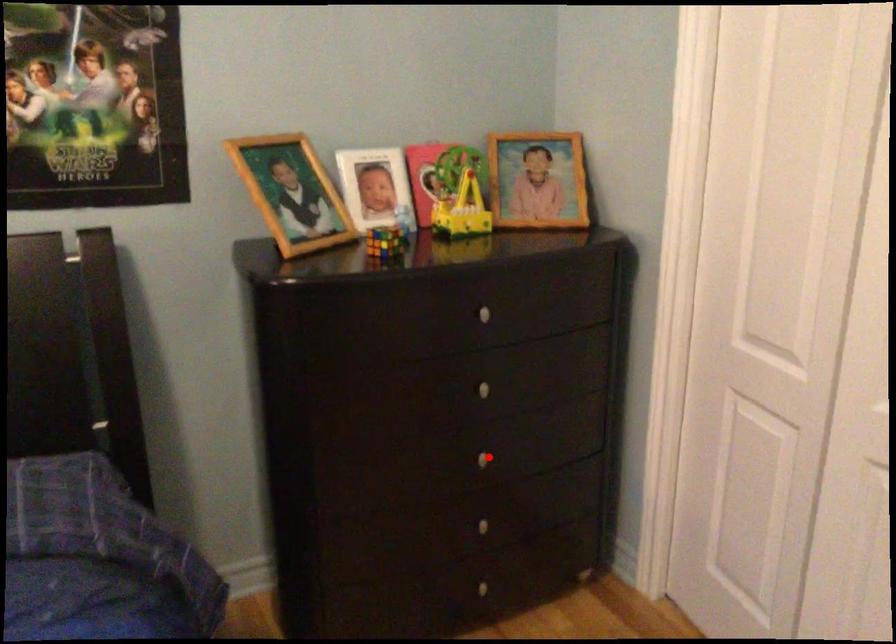
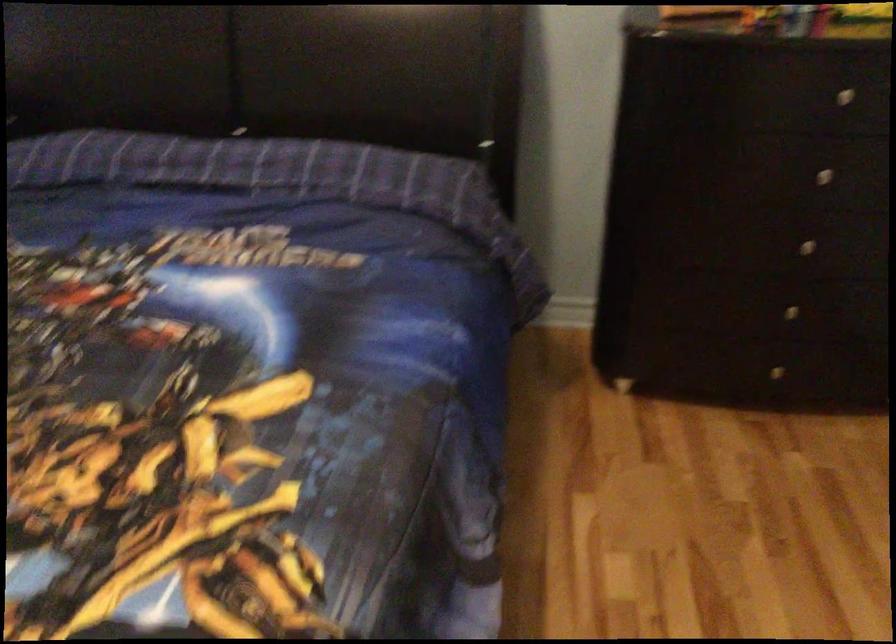
Question: I am providing you with two images of the same scene from different viewpoints. A red point is marked on the first image. At the location where the point appears in image 1, is it still visible in image 2?

Choices:
 (A) Yes
 (B) No

Answer: (A)